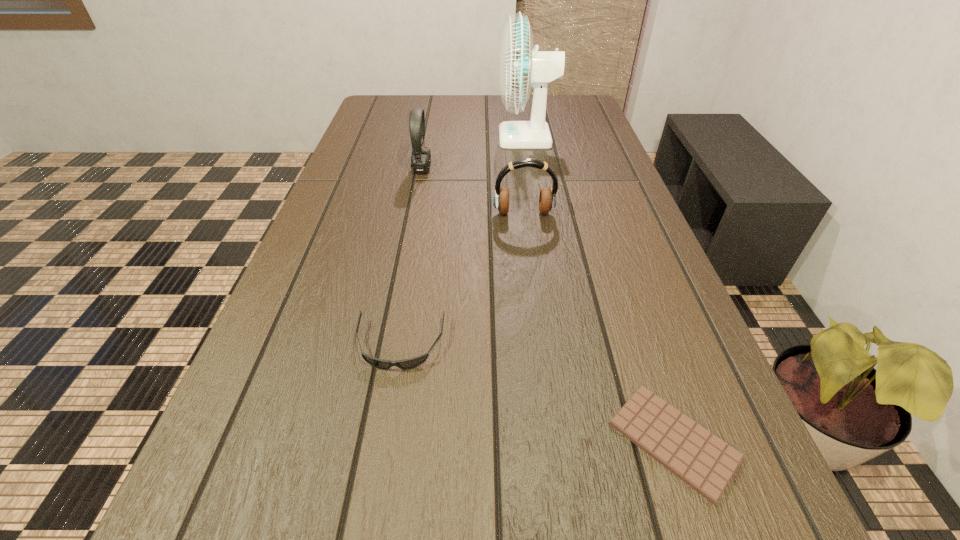
You are a GUI agent. You are given a task and a screenshot of the screen. Output one action in this format:
    pyautogui.click(x=<x>, y=<y>)
    Task: Click on the fan
    The height and width of the screenshot is (540, 960).
    Given the screenshot: What is the action you would take?
    pyautogui.click(x=521, y=66)

Find the location of a particular element. This screenshot has height=540, width=960. the left headset is located at coordinates pyautogui.click(x=421, y=158).

At what (x,y) coordinates should I click in order to perform the action: click on the nearer headset. Please return your answer as a coordinate pair (x, y). Looking at the image, I should click on (547, 200).

Identify the location of the right headset. (547, 200).

This screenshot has width=960, height=540. Identify the location of the fourth farthest object. (406, 364).

What are the coordinates of `the fourth tallest object` in the screenshot? It's located at (406, 364).

You are a GUI agent. You are given a task and a screenshot of the screen. Output one action in this format:
    pyautogui.click(x=<x>, y=<y>)
    Task: Click on the nearest object
    The height and width of the screenshot is (540, 960).
    Given the screenshot: What is the action you would take?
    point(706,463)

Identify the location of chocolate bar. The image size is (960, 540). (706, 463).

Find the location of a particular element. The width and height of the screenshot is (960, 540). vacant region located in front of the tallest object to face the airflow is located at coordinates (401, 138).

Locate an element on the screen. Image resolution: width=960 pixels, height=540 pixels. blank space located 0.130m in front of the tallest object to face the airflow is located at coordinates (456, 138).